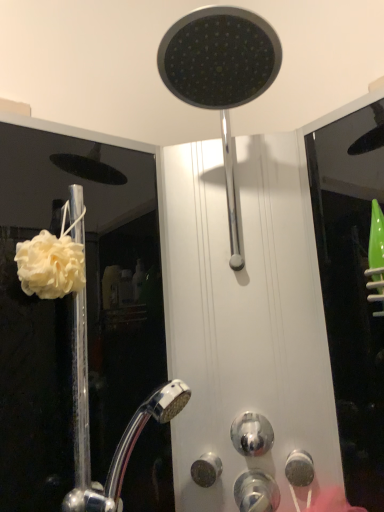
Where is `satin nickel knob at lower right, the third knob when ordered from left to right`? The height and width of the screenshot is (512, 384). satin nickel knob at lower right, the third knob when ordered from left to right is located at coordinates (299, 468).

What do you see at coordinates (206, 469) in the screenshot?
I see `satin nickel knob at lower center, arranged as the 3th knob when viewed from the right` at bounding box center [206, 469].

What is the approximate height of satin nickel knob at lower center, arranged as the 3th knob when viewed from the right?

satin nickel knob at lower center, arranged as the 3th knob when viewed from the right, is 2.40 inches in height.

Measure the distance between point (248, 425) and camera.

Point (248, 425) is 30.63 inches from camera.

This screenshot has width=384, height=512. What do you see at coordinates (252, 434) in the screenshot?
I see `shiny metallic knob at center, the 2th knob when ordered from left to right` at bounding box center [252, 434].

The height and width of the screenshot is (512, 384). I want to click on satin nickel knob at lower right, the first knob when ordered from right to left, so click(x=299, y=468).

Is satin nickel knob at lower center, marked as the first knob in a left-to-right arrangement, taller or shorter than matte black shower head at upper center?

satin nickel knob at lower center, marked as the first knob in a left-to-right arrangement, is shorter than matte black shower head at upper center.

Find the location of a particular element. Image resolution: width=384 pixels, height=512 pixels. the 3rd knob behind the matte black shower head at upper center, starting your count from the anchor is located at coordinates (206, 469).

Based on the photo, do you think satin nickel knob at lower center, arranged as the 3th knob when viewed from the right, is within matte black shower head at upper center, or outside of it?

satin nickel knob at lower center, arranged as the 3th knob when viewed from the right, is not inside matte black shower head at upper center, it's outside.

In the image, is white matte shower curtain at left on the left side or the right side of matte black shower head at upper center?

From the image, it's evident that white matte shower curtain at left is to the left of matte black shower head at upper center.

Can you confirm if white matte shower curtain at left is smaller than matte black shower head at upper center?

Yes.

From a real-world perspective, which object stands above the other?

matte black shower head at upper center is physically above.

Does point (82, 185) come in front of point (196, 16)?

No, it is not.

Considering the sizes of objects shiny metallic knob at center, which is the second knob from right to left, and matte black shower head at upper center in the image provided, who is shorter, shiny metallic knob at center, which is the second knob from right to left, or matte black shower head at upper center?

shiny metallic knob at center, which is the second knob from right to left, is shorter.

Which is in front, shiny metallic knob at center, which is the second knob from right to left, or matte black shower head at upper center?

matte black shower head at upper center.

From the image's perspective, which one is positioned higher, shiny metallic knob at center, which is the second knob from right to left, or matte black shower head at upper center?

matte black shower head at upper center.

Based on their sizes in the image, would you say shiny metallic knob at center, which is the second knob from right to left, is bigger or smaller than matte black shower head at upper center?

shiny metallic knob at center, which is the second knob from right to left, is smaller than matte black shower head at upper center.

Is white fluffy sponge at left located outside satin nickel knob at lower center, marked as the first knob in a left-to-right arrangement?

white fluffy sponge at left lies outside satin nickel knob at lower center, marked as the first knob in a left-to-right arrangement,'s area.

In the scene shown: Who is smaller, white fluffy sponge at left or satin nickel knob at lower center, arranged as the 3th knob when viewed from the right?

satin nickel knob at lower center, arranged as the 3th knob when viewed from the right.

Which is in front, point (45, 283) or point (206, 456)?

Positioned in front is point (45, 283).

From a real-world perspective, is white fluffy sponge at left beneath satin nickel knob at lower center, marked as the first knob in a left-to-right arrangement?

Incorrect, from a real-world perspective, white fluffy sponge at left is higher than satin nickel knob at lower center, marked as the first knob in a left-to-right arrangement.

Choose the correct answer: Is white fluffy sponge at left inside shiny metallic knob at center, the 2th knob when ordered from left to right, or outside it?

white fluffy sponge at left is not enclosed by shiny metallic knob at center, the 2th knob when ordered from left to right.

From a real-world perspective, who is located higher, white fluffy sponge at left or shiny metallic knob at center, the 2th knob when ordered from left to right?

In real-world perspective, white fluffy sponge at left is above.

Considering the sizes of white fluffy sponge at left and shiny metallic knob at center, which is the second knob from right to left, in the image, is white fluffy sponge at left taller or shorter than shiny metallic knob at center, which is the second knob from right to left,?

white fluffy sponge at left is taller than shiny metallic knob at center, which is the second knob from right to left.

From the image's perspective, is white fluffy sponge at left on white matte shower curtain at left?

Yes, from the image's perspective, white fluffy sponge at left is above white matte shower curtain at left.

Could white matte shower curtain at left be considered to be inside white fluffy sponge at left?

No, white matte shower curtain at left is not surrounded by white fluffy sponge at left.

In order to click on flower to the left of shiny metallic knob at center, which is the second knob from right to left in this screenshot , I will do `click(50, 265)`.

Which of these two, shiny metallic knob at center, which is the second knob from right to left, or white fluffy sponge at left, stands taller?

white fluffy sponge at left.

Is shiny metallic knob at center, the 2th knob when ordered from left to right, at the right side of white fluffy sponge at left?

Yes, shiny metallic knob at center, the 2th knob when ordered from left to right, is to the right of white fluffy sponge at left.

How different are the orientations of shiny metallic knob at center, which is the second knob from right to left, and white fluffy sponge at left in degrees?

48.3 degrees separate the facing orientations of shiny metallic knob at center, which is the second knob from right to left, and white fluffy sponge at left.

Identify the location of shower above the satin nickel knob at lower center, marked as the first knob in a left-to-right arrangement (from the image's perspective). The image size is (384, 512). (220, 75).

At what (x,y) coordinates should I click in order to perform the action: click on shower on the right of the white matte shower curtain at left. Please return your answer as a coordinate pair (x, y). The width and height of the screenshot is (384, 512). Looking at the image, I should click on (220, 75).

Considering their positions, is satin nickel knob at lower center, marked as the first knob in a left-to-right arrangement, positioned further to white fluffy sponge at left than white matte shower curtain at left?

Among the two, white matte shower curtain at left is located further to white fluffy sponge at left.

When comparing their distances from satin nickel knob at lower right, the first knob when ordered from right to left, does shiny metallic knob at center, the 2th knob when ordered from left to right, or white matte shower curtain at left seem closer?

shiny metallic knob at center, the 2th knob when ordered from left to right, is closer to satin nickel knob at lower right, the first knob when ordered from right to left.

Based on their spatial positions, is matte black shower head at upper center or satin nickel knob at lower right, the first knob when ordered from right to left, closer to satin nickel knob at lower center, marked as the first knob in a left-to-right arrangement?

satin nickel knob at lower right, the first knob when ordered from right to left.

Based on their spatial positions, is satin nickel knob at lower right, the first knob when ordered from right to left, or satin nickel knob at lower center, marked as the first knob in a left-to-right arrangement, further from matte black shower head at upper center?

Based on the image, satin nickel knob at lower center, marked as the first knob in a left-to-right arrangement, appears to be further to matte black shower head at upper center.

When comparing their distances from satin nickel knob at lower right, the third knob when ordered from left to right, does matte black shower head at upper center or white fluffy sponge at left seem further?

Among the two, matte black shower head at upper center is located further to satin nickel knob at lower right, the third knob when ordered from left to right.

Based on their spatial positions, is shiny metallic knob at center, which is the second knob from right to left, or satin nickel knob at lower center, marked as the first knob in a left-to-right arrangement, closer to satin nickel knob at lower right, the third knob when ordered from left to right?

The object closer to satin nickel knob at lower right, the third knob when ordered from left to right, is shiny metallic knob at center, which is the second knob from right to left.

Which object lies nearer to the anchor point satin nickel knob at lower right, the first knob when ordered from right to left, satin nickel knob at lower center, arranged as the 3th knob when viewed from the right, or white fluffy sponge at left?

Based on the image, satin nickel knob at lower center, arranged as the 3th knob when viewed from the right, appears to be nearer to satin nickel knob at lower right, the first knob when ordered from right to left.

Which object lies nearer to the anchor point matte black shower head at upper center, white matte shower curtain at left or shiny metallic knob at center, which is the second knob from right to left?

The object closer to matte black shower head at upper center is shiny metallic knob at center, which is the second knob from right to left.

This screenshot has height=512, width=384. Find the location of `screen door between white fluffy sponge at left and satin nickel knob at lower center, arranged as the 3th knob when viewed from the right, vertically`. screen door between white fluffy sponge at left and satin nickel knob at lower center, arranged as the 3th knob when viewed from the right, vertically is located at coordinates (72, 313).

This screenshot has width=384, height=512. I want to click on flower that lies between matte black shower head at upper center and satin nickel knob at lower center, marked as the first knob in a left-to-right arrangement, from top to bottom, so click(x=50, y=265).

The width and height of the screenshot is (384, 512). I want to click on flower between matte black shower head at upper center and shiny metallic knob at center, which is the second knob from right to left, from top to bottom, so click(x=50, y=265).

The width and height of the screenshot is (384, 512). Find the location of `screen door located between white fluffy sponge at left and satin nickel knob at lower right, the third knob when ordered from left to right, in the left-right direction`. screen door located between white fluffy sponge at left and satin nickel knob at lower right, the third knob when ordered from left to right, in the left-right direction is located at coordinates (72, 313).